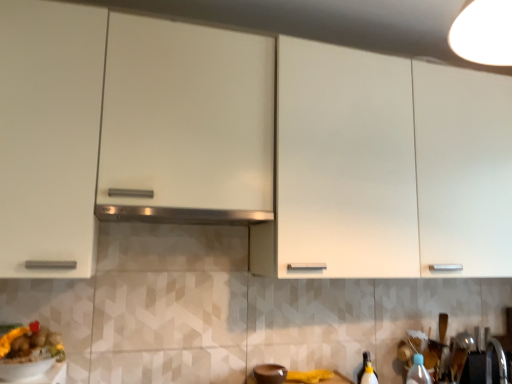
Question: Is yellow matte food at lower left turned away from brown matte bowl at lower center?

Choices:
 (A) yes
 (B) no

Answer: (B)

Question: Is yellow matte food at lower left with brown matte bowl at lower center?

Choices:
 (A) no
 (B) yes

Answer: (A)

Question: Does yellow matte food at lower left have a greater width compared to brown matte bowl at lower center?

Choices:
 (A) yes
 (B) no

Answer: (A)

Question: Does yellow matte food at lower left appear on the left side of brown matte bowl at lower center?

Choices:
 (A) yes
 (B) no

Answer: (A)

Question: Is yellow matte food at lower left thinner than brown matte bowl at lower center?

Choices:
 (A) yes
 (B) no

Answer: (B)

Question: Is translucent plastic bottle at lower right inside the boundaries of satin silver exhaust hood at center, or outside?

Choices:
 (A) outside
 (B) inside

Answer: (A)

Question: From the image's perspective, is translucent plastic bottle at lower right positioned above or below satin silver exhaust hood at center?

Choices:
 (A) below
 (B) above

Answer: (A)

Question: Considering their positions, is translucent plastic bottle at lower right located in front of or behind satin silver exhaust hood at center?

Choices:
 (A) front
 (B) behind

Answer: (B)

Question: Considering the positions of point (412, 369) and point (238, 213), is point (412, 369) closer or farther from the camera than point (238, 213)?

Choices:
 (A) closer
 (B) farther

Answer: (B)

Question: Considering their positions, is brown matte bowl at lower center located in front of or behind satin silver exhaust hood at center?

Choices:
 (A) behind
 (B) front

Answer: (A)

Question: Visually, is brown matte bowl at lower center positioned to the left or to the right of satin silver exhaust hood at center?

Choices:
 (A) right
 (B) left

Answer: (A)

Question: Looking at their shapes, would you say brown matte bowl at lower center is wider or thinner than satin silver exhaust hood at center?

Choices:
 (A) wide
 (B) thin

Answer: (B)

Question: From the image's perspective, relative to satin silver exhaust hood at center, is brown matte bowl at lower center above or below?

Choices:
 (A) above
 (B) below

Answer: (B)

Question: Considering the relative positions of white glossy cabinet at upper center and satin silver exhaust hood at center in the image provided, is white glossy cabinet at upper center to the left or to the right of satin silver exhaust hood at center?

Choices:
 (A) left
 (B) right

Answer: (B)

Question: From their relative heights in the image, would you say white glossy cabinet at upper center is taller or shorter than satin silver exhaust hood at center?

Choices:
 (A) tall
 (B) short

Answer: (A)